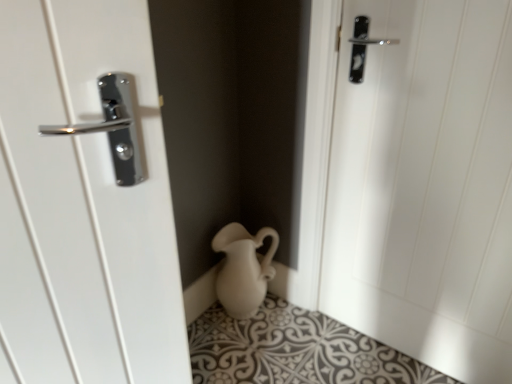
The height and width of the screenshot is (384, 512). What do you see at coordinates (243, 269) in the screenshot?
I see `white matte jug at center` at bounding box center [243, 269].

Measure the distance between white matte jug at center and camera.

white matte jug at center and camera are 1.42 meters apart from each other.

Locate an element on the screen. white matte jug at center is located at coordinates (243, 269).

Find the location of `white glossy door handle at upper center`. white glossy door handle at upper center is located at coordinates (425, 186).

Describe the element at coordinates (425, 186) in the screenshot. Image resolution: width=512 pixels, height=384 pixels. I see `white glossy door handle at upper center` at that location.

Locate an element on the screen. white matte jug at center is located at coordinates (243, 269).

Is white matte jug at center at the left side of white glossy door handle at upper center?

Indeed, white matte jug at center is positioned on the left side of white glossy door handle at upper center.

Is the depth of white matte jug at center less than that of white glossy door handle at upper center?

No, it is not.

Between point (253, 253) and point (434, 182), which one is positioned behind?

The point (253, 253) is more distant.

From the image's perspective, between white matte jug at center and white glossy door handle at upper center, who is located below?

white matte jug at center appears lower in the image.

From the picture: From a real-world perspective, between white matte jug at center and white glossy door handle at upper center, who is vertically higher?

In real-world perspective, white glossy door handle at upper center is above.

Is white matte jug at center wider than white glossy door handle at upper center?

Indeed, white matte jug at center has a greater width compared to white glossy door handle at upper center.

Does white matte jug at center have a lesser height compared to white glossy door handle at upper center?

Indeed, white matte jug at center has a lesser height compared to white glossy door handle at upper center.

Who is smaller, white matte jug at center or white glossy door handle at upper center?

white matte jug at center is smaller.

Which is correct: white matte jug at center is inside white glossy door handle at upper center, or outside of it?

white matte jug at center is outside white glossy door handle at upper center.

Is white matte jug at center next to white glossy door handle at upper center and touching it?

white matte jug at center and white glossy door handle at upper center are clearly separated.

Is white matte jug at center looking in the opposite direction of white glossy door handle at upper center?

No, white matte jug at center is not facing away from white glossy door handle at upper center.

What's the angular difference between white matte jug at center and white glossy door handle at upper center's facing directions?

The facing directions of white matte jug at center and white glossy door handle at upper center are 94.2 degrees apart.

Measure the distance from white matte jug at center to white glossy door handle at upper center.

20.13 inches.

Identify the location of door that appears in front of the white matte jug at center. Image resolution: width=512 pixels, height=384 pixels. (425, 186).

Does white glossy door handle at upper center appear on the right side of white matte jug at center?

Yes, white glossy door handle at upper center is to the right of white matte jug at center.

Is white glossy door handle at upper center in front of or behind white matte jug at center in the image?

Visually, white glossy door handle at upper center is located in front of white matte jug at center.

Is point (345, 180) closer to camera compared to point (277, 246)?

Yes, point (345, 180) is closer to viewer.

From the image's perspective, relative to white matte jug at center, is white glossy door handle at upper center above or below?

Clearly, from the image's perspective, white glossy door handle at upper center is above white matte jug at center.

From a real-world perspective, is white glossy door handle at upper center beneath white matte jug at center?

No, from a real-world perspective, white glossy door handle at upper center is not below white matte jug at center.

Considering the relative sizes of white glossy door handle at upper center and white matte jug at center in the image provided, is white glossy door handle at upper center thinner than white matte jug at center?

Correct, the width of white glossy door handle at upper center is less than that of white matte jug at center.

Between white glossy door handle at upper center and white matte jug at center, which one has less height?

Standing shorter between the two is white matte jug at center.

Between white glossy door handle at upper center and white matte jug at center, which one has larger size?

With larger size is white glossy door handle at upper center.

Is white glossy door handle at upper center spatially inside white matte jug at center, or outside of it?

white glossy door handle at upper center exists outside the volume of white matte jug at center.

Is white glossy door handle at upper center next to white matte jug at center and touching it?

No, white glossy door handle at upper center is not next to white matte jug at center.

Is white glossy door handle at upper center turned away from white matte jug at center?

No.

Find the location of a particular element. The width and height of the screenshot is (512, 384). jug below the white glossy door handle at upper center (from the image's perspective) is located at coordinates (243, 269).

Locate an element on the screen. This screenshot has width=512, height=384. jug lying behind the white glossy door handle at upper center is located at coordinates (243, 269).

The width and height of the screenshot is (512, 384). In order to click on door located above the white matte jug at center (from a real-world perspective) in this screenshot , I will do `click(425, 186)`.